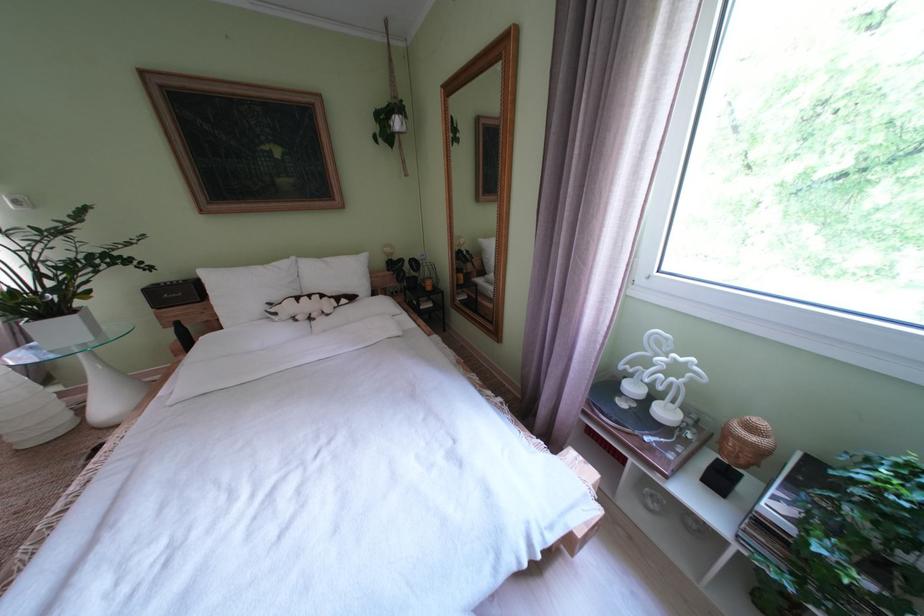
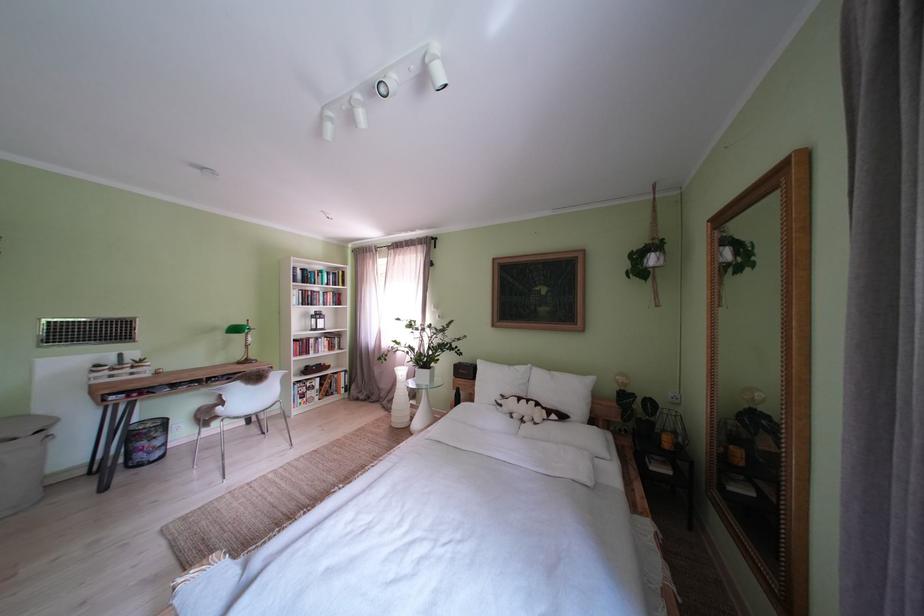
Where in the second image is the point corresponding to the point at 286,318 from the first image?

(512, 411)